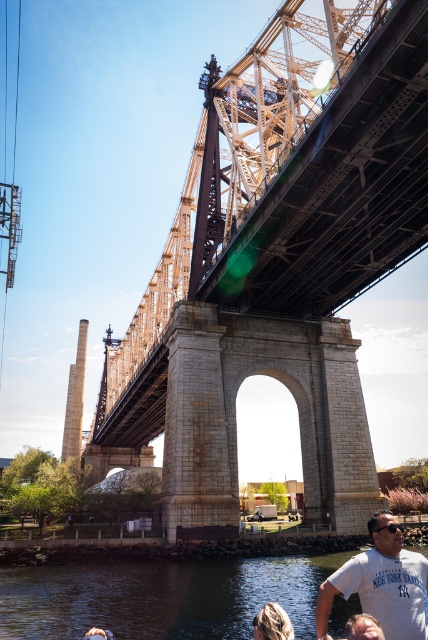
Question: Estimate the real-world distances between objects in this image. Which object is farther from the clear water at lower center?

Choices:
 (A) rusty metal bridge at center
 (B) white cotton t-shirt at lower right

Answer: (A)

Question: Which point appears farthest from the camera in this image?

Choices:
 (A) (382, 596)
 (B) (229, 368)

Answer: (B)

Question: Does rusty metal bridge at center have a smaller size compared to clear water at lower center?

Choices:
 (A) yes
 (B) no

Answer: (B)

Question: Is the position of rusty metal bridge at center less distant than that of white cotton t-shirt at lower right?

Choices:
 (A) no
 (B) yes

Answer: (A)

Question: Among these objects, which one is nearest to the camera?

Choices:
 (A) white cotton t-shirt at lower right
 (B) clear water at lower center

Answer: (A)

Question: Does clear water at lower center come in front of white cotton t-shirt at lower right?

Choices:
 (A) yes
 (B) no

Answer: (B)